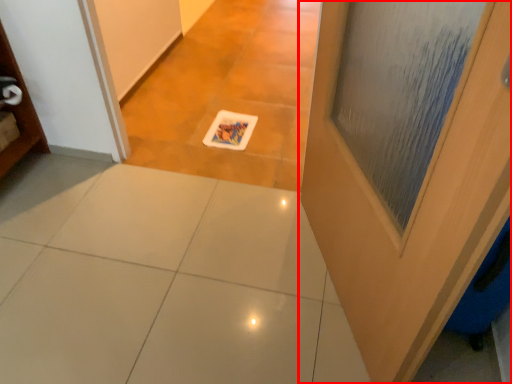
Question: Observing the image, what is the correct spatial positioning of door (annotated by the red box) in reference to ceramic tile?

Choices:
 (A) left
 (B) right

Answer: (B)